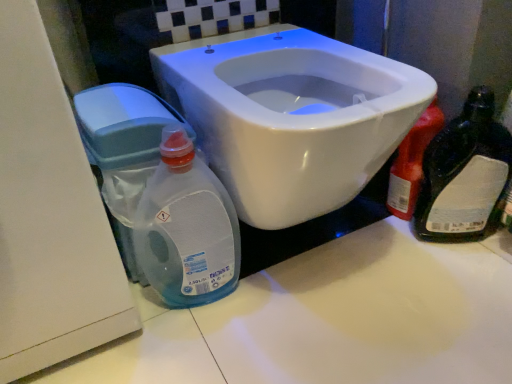
I want to click on free area in between transparent plastic bottle at lower left and translucent plastic bottle at right, so click(x=318, y=246).